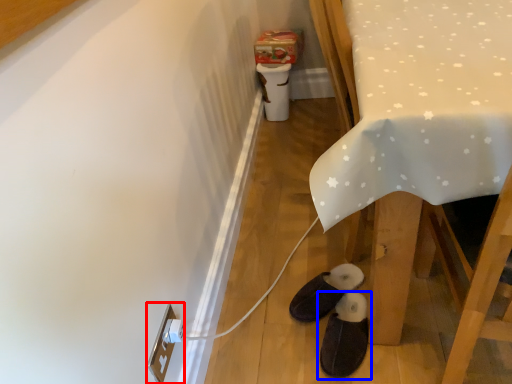
Question: Which point is closer to the camera, electric outlet (highlighted by a red box) or footwear (highlighted by a blue box)?

Choices:
 (A) electric outlet
 (B) footwear

Answer: (A)